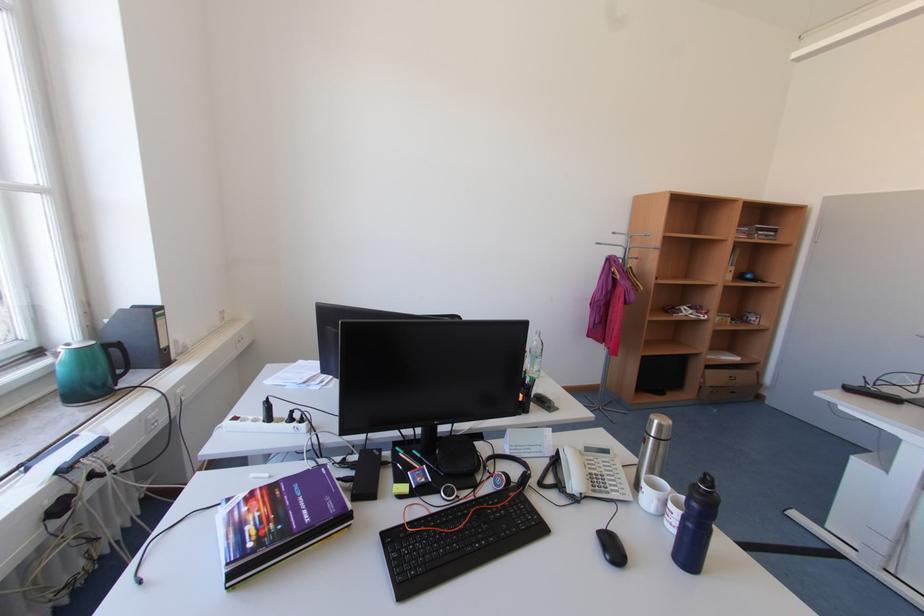
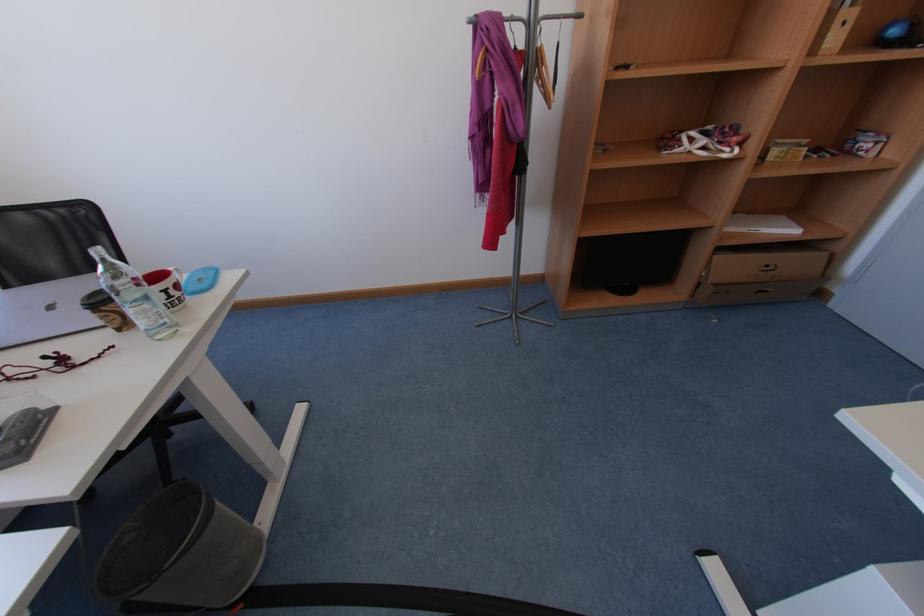
The images are taken continuously from a first-person perspective. In which direction are you moving?

The cameraman moved toward right, forward.